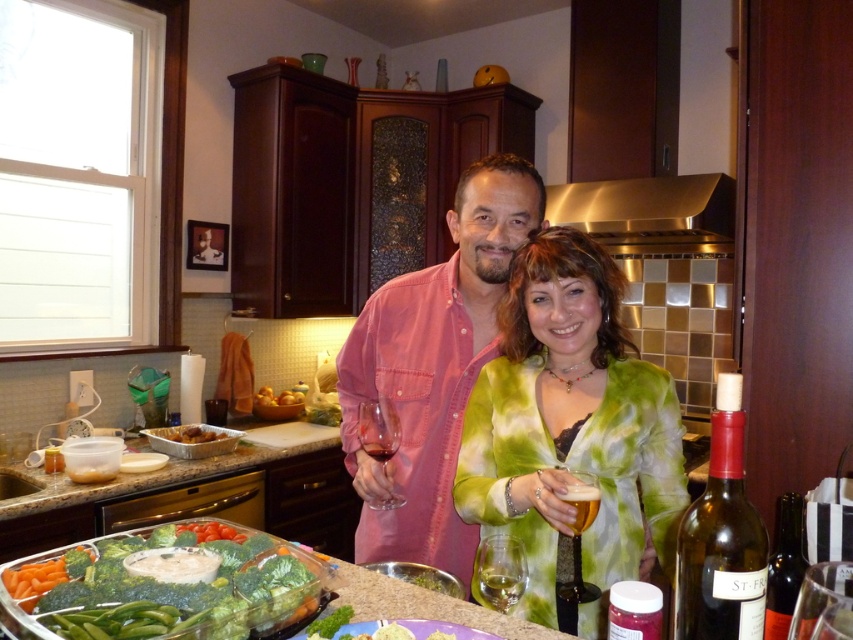
Question: Can you confirm if green silk blouse at center is positioned to the right of translucent glass bottle at lower right?

Choices:
 (A) yes
 (B) no

Answer: (B)

Question: Where is pink cotton shirt at center located in relation to clear glass wine glass at center in the image?

Choices:
 (A) below
 (B) above

Answer: (B)

Question: Which point is farther to the camera?

Choices:
 (A) (775, 604)
 (B) (618, 548)
 (C) (384, 428)

Answer: (C)

Question: Which point is closer to the camera?

Choices:
 (A) translucent glass wine at center
 (B) green leafy vegetables at lower left

Answer: (B)

Question: Which object is closer to the camera taking this photo?

Choices:
 (A) translucent glass beer at center
 (B) translucent glass beer at lower center

Answer: (A)

Question: Does clear glass wine glass at center appear over yellow matte potatoes at center?

Choices:
 (A) no
 (B) yes

Answer: (A)